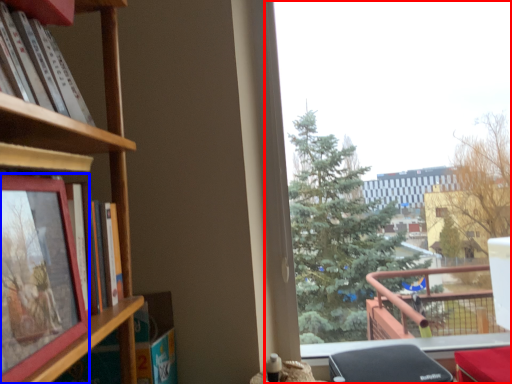
Question: Which object is further to the camera taking this photo, window (highlighted by a red box) or picture frame (highlighted by a blue box)?

Choices:
 (A) window
 (B) picture frame

Answer: (A)